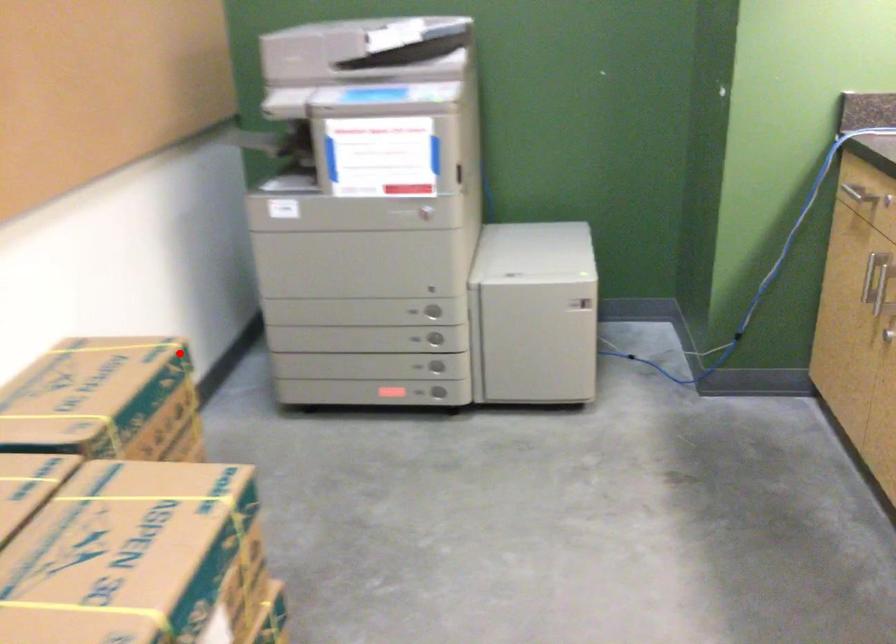
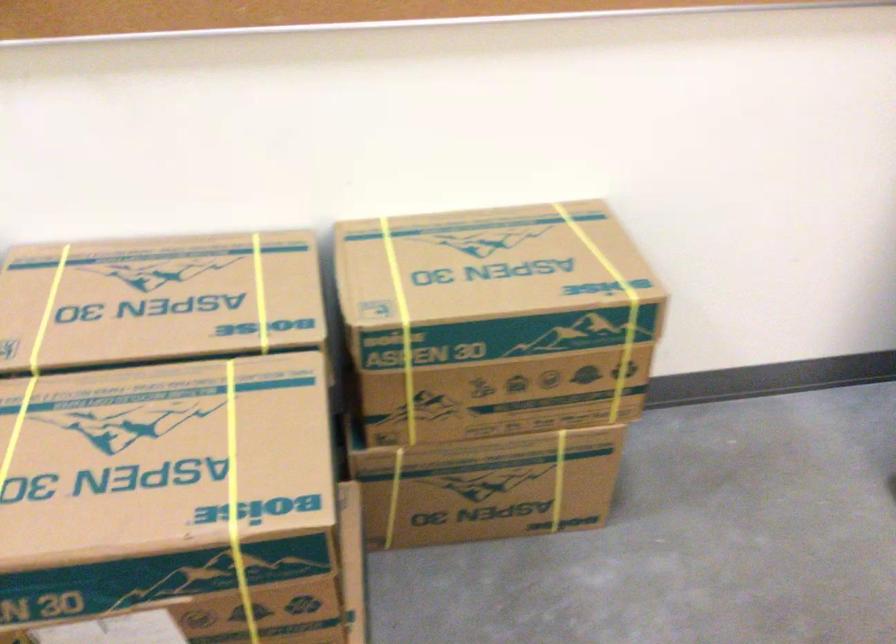
Find the pixel in the second image that matches the highlighted location in the first image.

(609, 304)